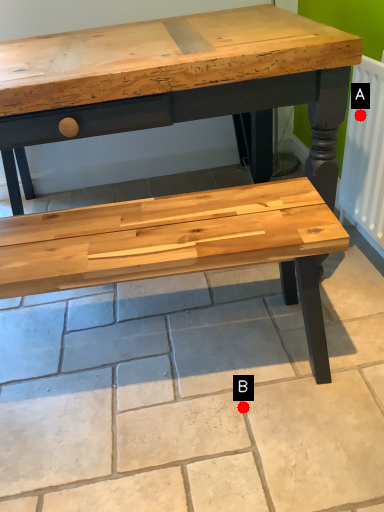
Question: Two points are circled on the image, labeled by A and B beside each circle. Which of the following is the farthest from the observer?

Choices:
 (A) A is further
 (B) B is further

Answer: (A)